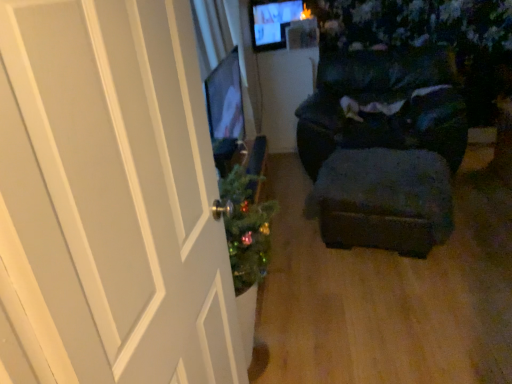
What do you see at coordinates (384, 200) in the screenshot? I see `velvet dark blue stool at center` at bounding box center [384, 200].

This screenshot has height=384, width=512. What are the coordinates of `white wood door at left` in the screenshot? It's located at (109, 200).

This screenshot has height=384, width=512. Find the location of `velvet dark blue stool at center`. velvet dark blue stool at center is located at coordinates (384, 200).

Considering the points (83, 55) and (444, 46), which point is in front, point (83, 55) or point (444, 46)?

The point (83, 55) is closer.

From a real-world perspective, which is physically below, white wood door at left or dark fabric chair at center?

dark fabric chair at center is physically lower.

Is white wood door at left placed right next to dark fabric chair at center?

No, white wood door at left is not in contact with dark fabric chair at center.

Considering the sizes of objects white wood door at left and dark fabric chair at center in the image provided, who is smaller, white wood door at left or dark fabric chair at center?

Smaller between the two is white wood door at left.

From the image's perspective, is velvet dark blue stool at center on white wood door at left?

Yes, from the image's perspective, velvet dark blue stool at center is over white wood door at left.

Is velvet dark blue stool at center wider or thinner than white wood door at left?

Clearly, velvet dark blue stool at center has more width compared to white wood door at left.

Is velvet dark blue stool at center shorter than white wood door at left?

Yes, velvet dark blue stool at center is shorter than white wood door at left.

How much distance is there between velvet dark blue stool at center and white wood door at left?

velvet dark blue stool at center is 5.16 feet from white wood door at left.

Is velvet dark blue stool at center to the left or to the right of dark fabric chair at center in the image?

Based on their positions, velvet dark blue stool at center is located to the left of dark fabric chair at center.

Is velvet dark blue stool at center aimed at dark fabric chair at center?

No, velvet dark blue stool at center is not oriented towards dark fabric chair at center.

Which is behind, velvet dark blue stool at center or dark fabric chair at center?

dark fabric chair at center.

From a real-world perspective, is velvet dark blue stool at center positioned under dark fabric chair at center based on gravity?

Indeed, from a real-world perspective, velvet dark blue stool at center is positioned beneath dark fabric chair at center.

Does point (461, 143) lie behind point (60, 192)?

Yes.

How different are the orientations of dark fabric chair at center and white wood door at left in degrees?

97.6 degrees separate the facing orientations of dark fabric chair at center and white wood door at left.

Is dark fabric chair at center turned away from white wood door at left?

No, white wood door at left is not at the back of dark fabric chair at center.

How far apart are white wood door at left and velvet dark blue stool at center?

A distance of 5.16 feet exists between white wood door at left and velvet dark blue stool at center.

From a real-world perspective, is white wood door at left physically located above or below velvet dark blue stool at center?

From a real-world perspective, white wood door at left is physically above velvet dark blue stool at center.

Could you tell me if white wood door at left is turned towards velvet dark blue stool at center?

Answer: No.

Is white wood door at left completely or partially outside of velvet dark blue stool at center?

Absolutely, white wood door at left is external to velvet dark blue stool at center.

Is point (337, 104) farther from camera compared to point (352, 190)?

Yes, it is.

From the image's perspective, is dark fabric chair at center beneath velvet dark blue stool at center?

Actually, dark fabric chair at center appears above velvet dark blue stool at center in the image.

Considering the sizes of dark fabric chair at center and velvet dark blue stool at center in the image, is dark fabric chair at center wider or thinner than velvet dark blue stool at center?

dark fabric chair at center is wider than velvet dark blue stool at center.

Locate an element on the screen. Image resolution: width=512 pixels, height=384 pixels. furniture above the velvet dark blue stool at center (from the image's perspective) is located at coordinates (382, 103).

At what (x,y) coordinates should I click in order to perform the action: click on furniture on the right of white wood door at left. Please return your answer as a coordinate pair (x, y). Looking at the image, I should click on (382, 103).

Find the location of `door above the velvet dark blue stool at center (from a real-world perspective)`. door above the velvet dark blue stool at center (from a real-world perspective) is located at coordinates (109, 200).

Estimate the real-world distances between objects in this image. Which object is further from dark fabric chair at center, white wood door at left or velvet dark blue stool at center?

white wood door at left is further to dark fabric chair at center.

Estimate the real-world distances between objects in this image. Which object is closer to velvet dark blue stool at center, dark fabric chair at center or white wood door at left?

dark fabric chair at center is positioned closer to the anchor velvet dark blue stool at center.

Considering their positions, is velvet dark blue stool at center positioned closer to dark fabric chair at center than white wood door at left?

Based on the image, velvet dark blue stool at center appears to be nearer to dark fabric chair at center.

Consider the image. Which object lies further to the anchor point white wood door at left, dark fabric chair at center or velvet dark blue stool at center?

Among the two, dark fabric chair at center is located further to white wood door at left.

Estimate the real-world distances between objects in this image. Which object is closer to white wood door at left, velvet dark blue stool at center or dark fabric chair at center?

velvet dark blue stool at center is positioned closer to the anchor white wood door at left.

Based on their spatial positions, is white wood door at left or dark fabric chair at center further from velvet dark blue stool at center?

Based on the image, white wood door at left appears to be further to velvet dark blue stool at center.

I want to click on stool between white wood door at left and dark fabric chair at center along the z-axis, so click(384, 200).